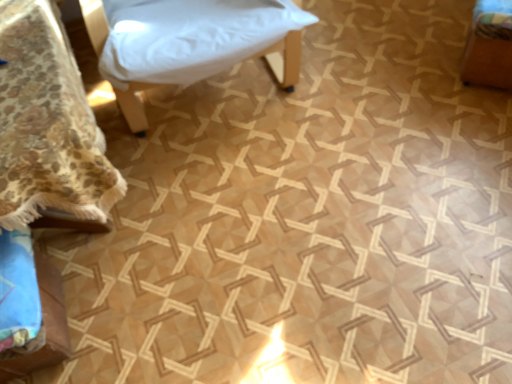
Where is `vacant space to the left of wooden box at right, which appears as the first furniture when viewed from the right`? The image size is (512, 384). vacant space to the left of wooden box at right, which appears as the first furniture when viewed from the right is located at coordinates (418, 75).